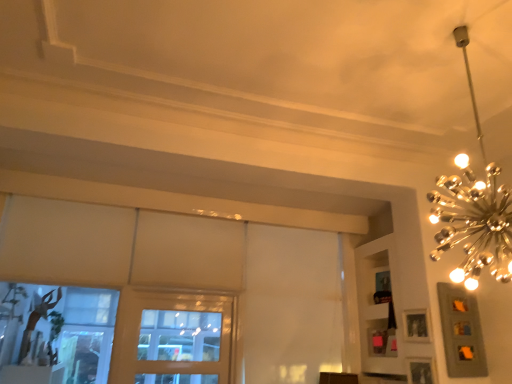
Question: Is matte silver picture frame at upper right, the first picture frame positioned from the top, to the left or to the right of gold metallic chandelier at upper right in the image?

Choices:
 (A) left
 (B) right

Answer: (B)

Question: From a real-world perspective, relative to gold metallic chandelier at upper right, is matte silver picture frame at upper right, the first picture frame positioned from the top, vertically above or below?

Choices:
 (A) below
 (B) above

Answer: (A)

Question: Estimate the real-world distances between objects in this image. Which object is farther from the matte silver picture frame at upper right, the first picture frame positioned from the top?

Choices:
 (A) wooden window at center
 (B) gold metallic chandelier at upper right
 (C) white matte shelf at upper right
 (D) wooden picture frame at lower right, marked as the 2th picture frame in a top-to-bottom arrangement

Answer: (A)

Question: Estimate the real-world distances between objects in this image. Which object is farther from the gold metallic chandelier at upper right?

Choices:
 (A) matte silver picture frame at upper right, the first picture frame positioned from the top
 (B) wooden picture frame at lower right, the first picture frame ordered from the bottom
 (C) wooden window at center
 (D) white matte shelf at upper right

Answer: (C)